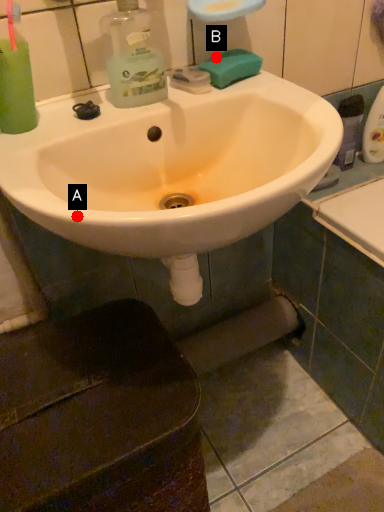
Question: Two points are circled on the image, labeled by A and B beside each circle. Which point appears closest to the camera in this image?

Choices:
 (A) A is closer
 (B) B is closer

Answer: (A)